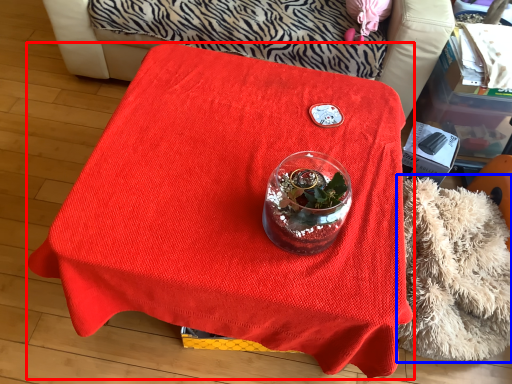
Question: Which of the following is the farthest to the observer, table (highlighted by a red box) or blanket (highlighted by a blue box)?

Choices:
 (A) table
 (B) blanket

Answer: (B)